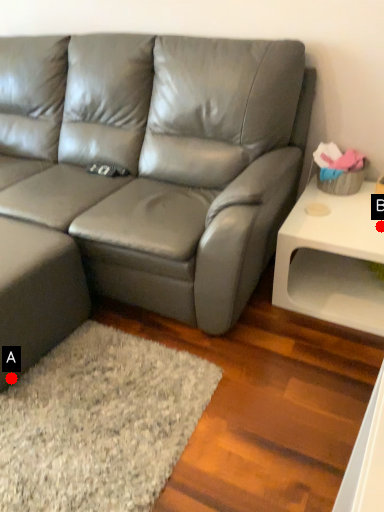
Question: Two points are circled on the image, labeled by A and B beside each circle. Which point is further to the camera?

Choices:
 (A) A is further
 (B) B is further

Answer: (B)